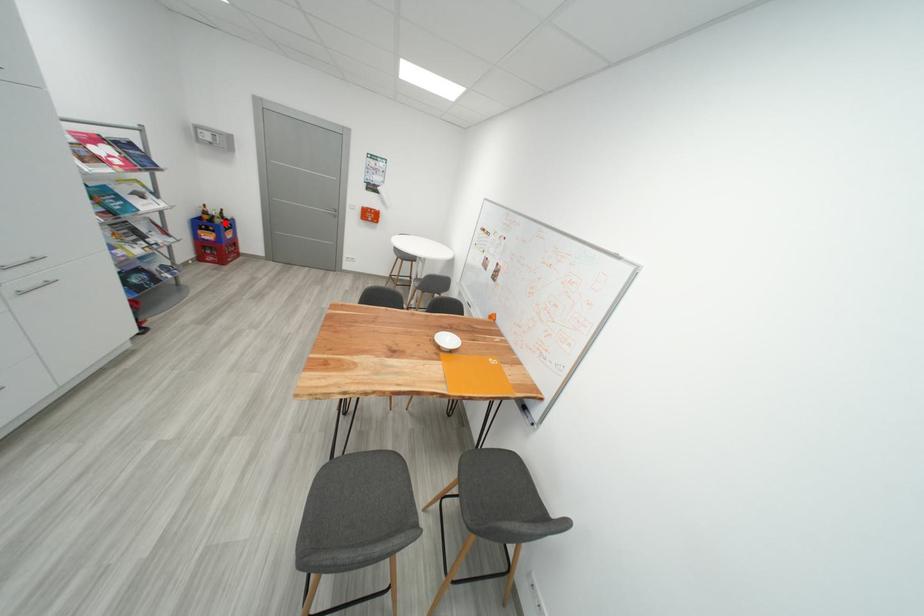
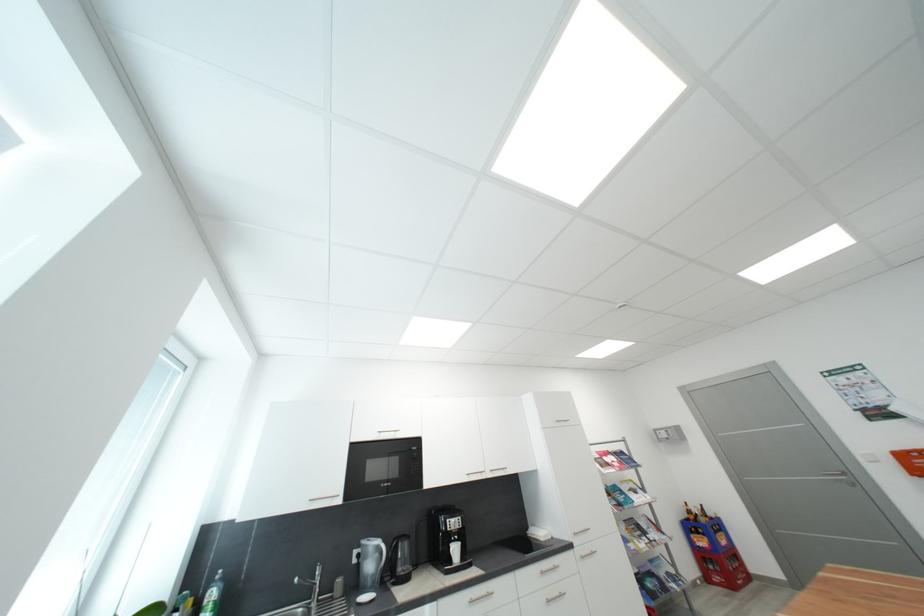
Question: I am providing you with two images of the same scene from different viewpoints. A red point is marked on the first image. Is the red point's position out of view in image 2?

Choices:
 (A) Yes
 (B) No

Answer: (B)